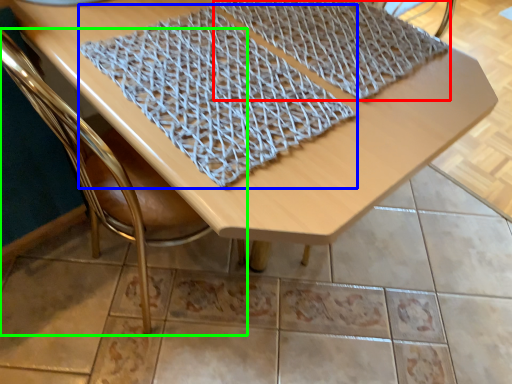
Question: Which object is the farthest from blanket (highlighted by a red box)? Choose among these: blanket (highlighted by a blue box) or chair (highlighted by a green box).

Choices:
 (A) blanket
 (B) chair

Answer: (B)